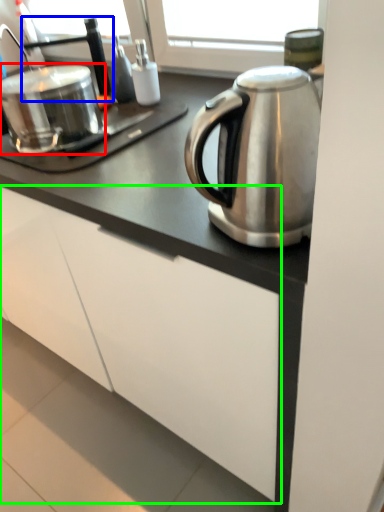
Question: Considering the real-world distances, which object is farthest from appliance (highlighted by a red box)? faucet (highlighted by a blue box) or cabinetry (highlighted by a green box)?

Choices:
 (A) faucet
 (B) cabinetry

Answer: (B)